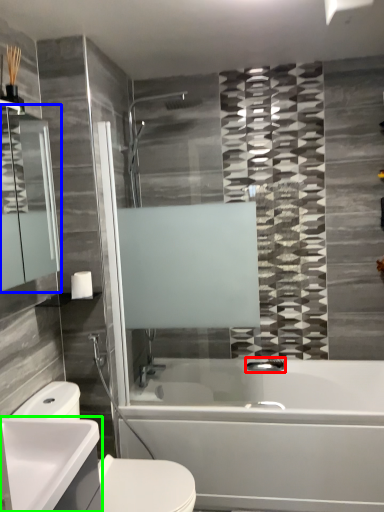
Question: Which is nearer to the plumbing fixture (highlighted by a red box)? mirror (highlighted by a blue box) or counter top (highlighted by a green box).

Choices:
 (A) mirror
 (B) counter top

Answer: (B)